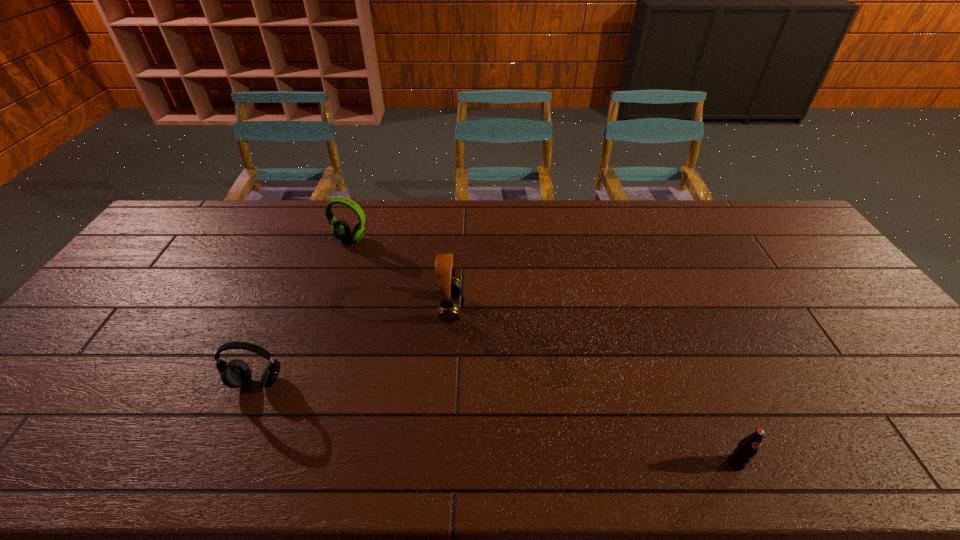
Image resolution: width=960 pixels, height=540 pixels. Identify the location of object that is at the near edge. (748, 447).

I want to click on vacant area at the far edge, so click(x=700, y=202).

Image resolution: width=960 pixels, height=540 pixels. Identify the location of free space at the near edge of the desktop. (334, 443).

In the image, there is a desktop. Where is `vacant space at the left edge`? This screenshot has width=960, height=540. vacant space at the left edge is located at coordinates (48, 417).

At what (x,y) coordinates should I click in order to perform the action: click on vacant area at the right edge. Please return your answer as a coordinate pair (x, y). Looking at the image, I should click on (x=846, y=303).

Locate an element on the screen. vacant space at the far left corner of the desktop is located at coordinates (192, 203).

Image resolution: width=960 pixels, height=540 pixels. In the image, there is a desktop. Find the location of `free space at the far right corner`. free space at the far right corner is located at coordinates (774, 235).

Find the location of `empty space between the second object from right to left and the farthest headset`. empty space between the second object from right to left and the farthest headset is located at coordinates pos(400,274).

Find the location of a particular element. Image resolution: width=960 pixels, height=540 pixels. free point between the second farthest headset and the second nearest object is located at coordinates (354, 345).

I want to click on vacant space in between the nearest object and the nearest headset, so click(496, 423).